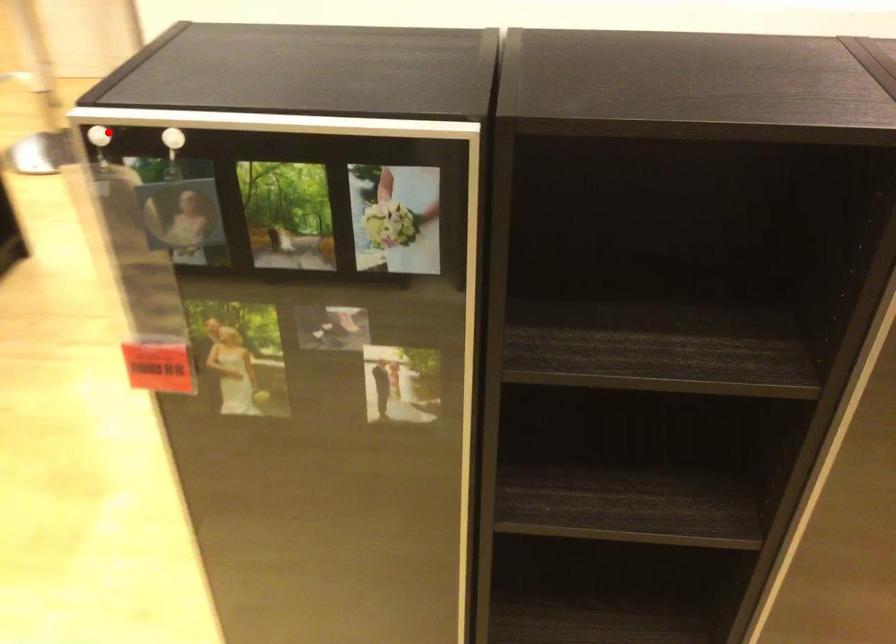
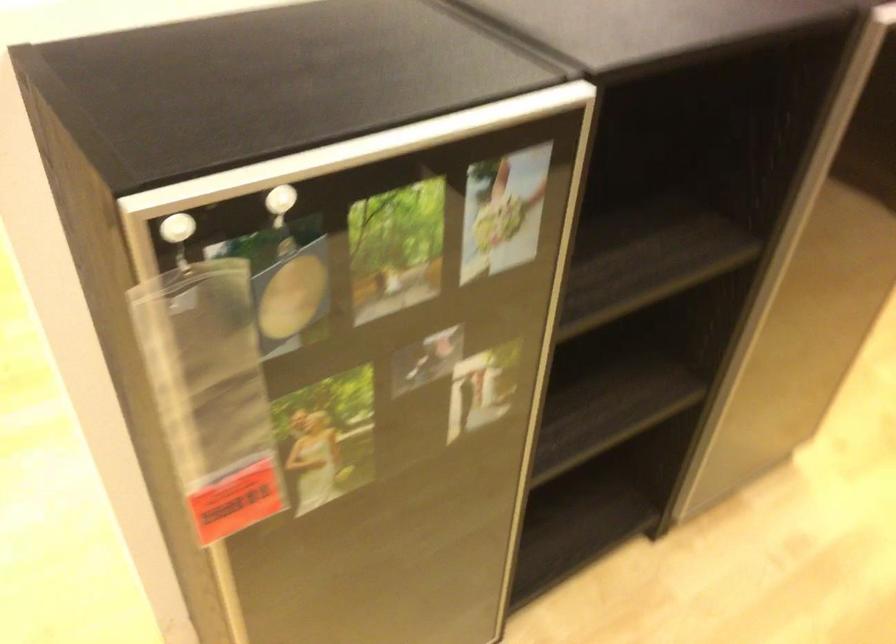
Question: I am providing you with two images of the same scene from different viewpoints. Given a red point in image1, look at the same physical point in image2. Is it:

Choices:
 (A) Closer to the viewpoint
 (B) Farther from the viewpoint

Answer: (A)